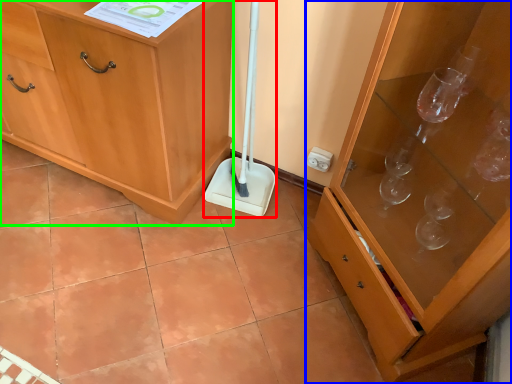
Question: Which object is the closest to the shovel (highlighted by a red box)? Choose among these: cabinetry (highlighted by a blue box) or cabinetry (highlighted by a green box).

Choices:
 (A) cabinetry
 (B) cabinetry

Answer: (B)